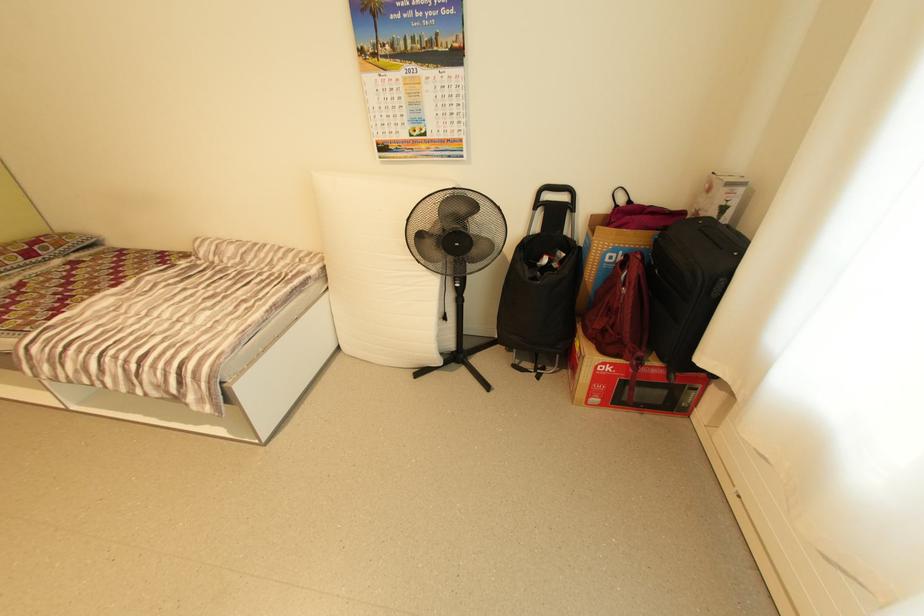
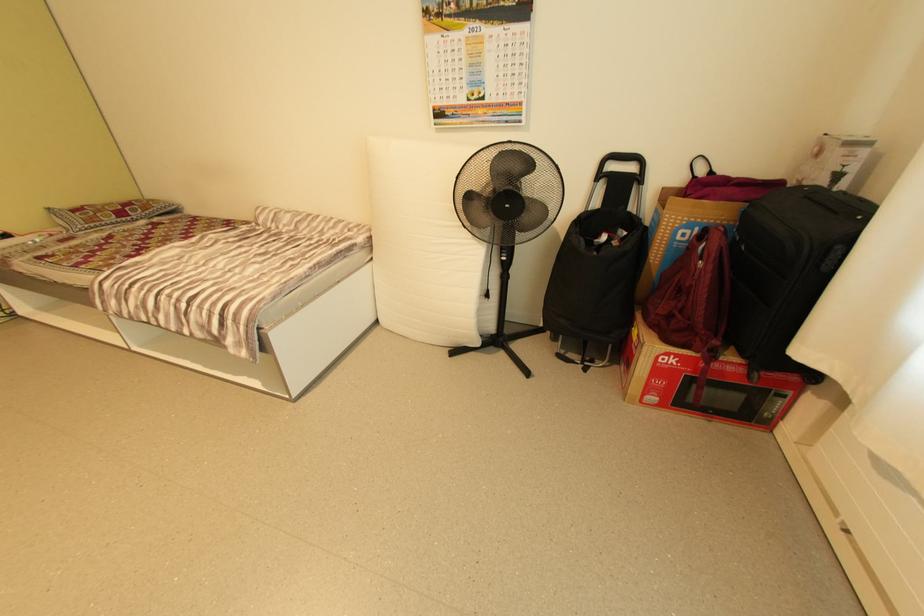
Question: In a continuous first-person perspective shot, in which direction is the camera moving?

Choices:
 (A) Left
 (B) Right
 (C) Forward
 (D) Backward

Answer: (C)